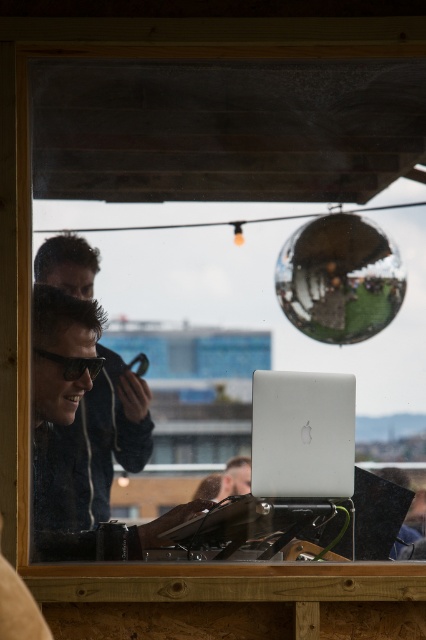
Question: Which object is positioned farthest from the wooden table at center?

Choices:
 (A) shiny metallic sphere at upper center
 (B) matte black sunglasses at lower left
 (C) black matte goggles at center
 (D) satin silver laptop at center

Answer: (A)

Question: Based on their relative distances, which object is nearer to the black matte goggles at center?

Choices:
 (A) shiny metallic sphere at upper center
 (B) satin silver laptop at center
 (C) wooden table at center

Answer: (B)

Question: Which point appears closest to the camera in this image?

Choices:
 (A) (74, 356)
 (B) (319, 314)
 (C) (48, 440)
 (D) (293, 465)

Answer: (C)

Question: Does shiny metallic sphere at upper center appear over black matte goggles at center?

Choices:
 (A) yes
 (B) no

Answer: (A)

Question: Does shiny metallic sphere at upper center lie behind black matte goggles at center?

Choices:
 (A) no
 (B) yes

Answer: (B)

Question: Is satin silver laptop at center bigger than black matte goggles at center?

Choices:
 (A) no
 (B) yes

Answer: (B)